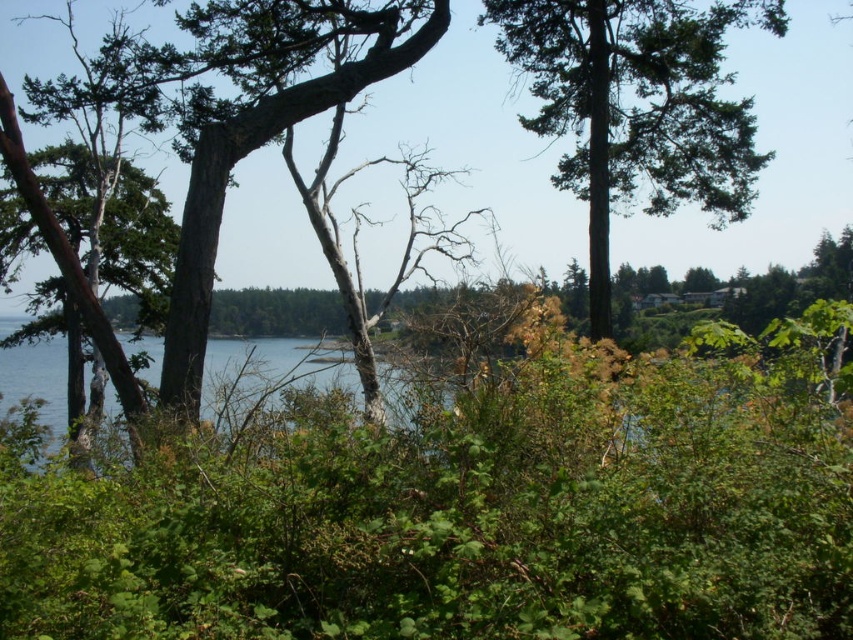
Question: Considering the real-world distances, which object is closest to the green textured tree at center?

Choices:
 (A) green rough bark tree at center
 (B) blue water at center

Answer: (B)

Question: Among these points, which one is farthest from the camera?

Choices:
 (A) [346, 84]
 (B) [538, 120]
 (C) [6, 353]

Answer: (C)

Question: Is green textured tree at center above blue water at center?

Choices:
 (A) no
 (B) yes

Answer: (B)

Question: Which of the following is the closest to the observer?

Choices:
 (A) blue water at center
 (B) green textured tree at center

Answer: (A)

Question: Is green textured tree at center to the right of green rough bark tree at center from the viewer's perspective?

Choices:
 (A) no
 (B) yes

Answer: (B)

Question: Can you confirm if green rough bark tree at center is positioned below blue water at center?

Choices:
 (A) no
 (B) yes

Answer: (A)